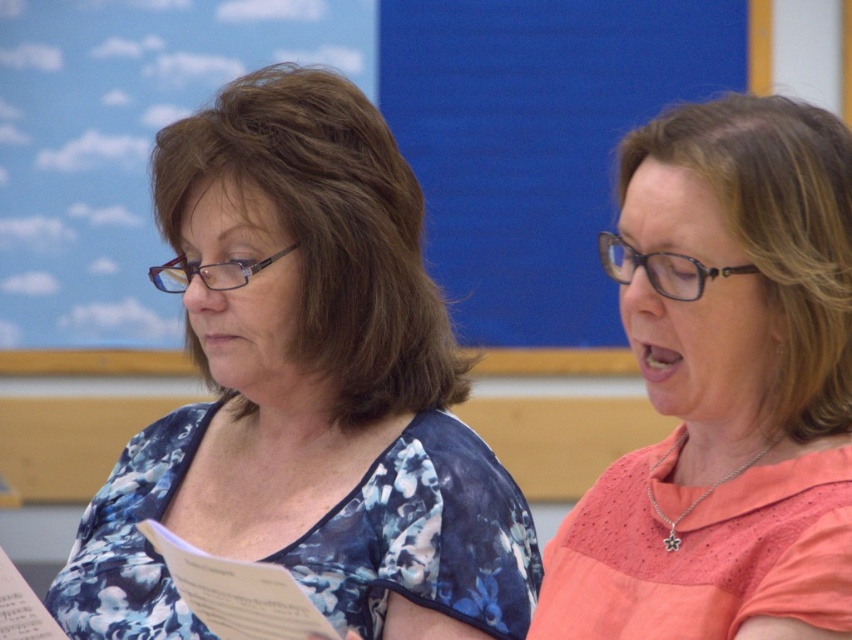
You are an interior designer assessing the space. The blue floral blouse at center and the blue matte bulletin board at upper center are both part of the room design. Which object takes up more visual space in the room?

The blue floral blouse at center takes up more visual space in the room because it is larger in size than the blue matte bulletin board at upper center.

You are a photographer setting up for a group photo in this classroom. You notice the pink fabric shirt at upper right and the blue matte bulletin board at upper center. Which object should you focus on first if you want to capture the larger object in your frame?

The pink fabric shirt at upper right is larger in size than the blue matte bulletin board at upper center, so you should focus on the pink fabric shirt at upper right first to capture the larger object.

You are a photographer setting up for a group photo in this classroom. You need to ensure that both the pink fabric shirt at upper right and the blue matte bulletin board at upper center are visible in the frame. Based on their positions, which object should appear larger in the photo?

The pink fabric shirt at upper right is closer to the viewer than the blue matte bulletin board at upper center, so it will appear larger in the photo.